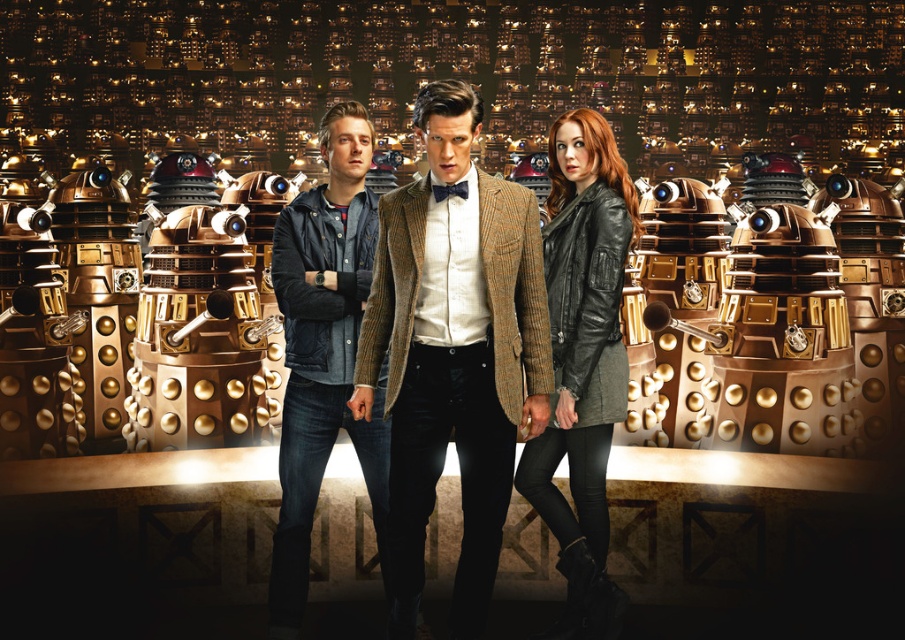
Question: Which object is closer to the camera taking this photo?

Choices:
 (A) black leather jacket at center
 (B) denim jacket at center

Answer: (A)

Question: Where is brown corduroy blazer at center located in relation to black leather jacket at center in the image?

Choices:
 (A) left
 (B) right

Answer: (A)

Question: Which point is farther to the camera?

Choices:
 (A) (420, 236)
 (B) (335, 250)

Answer: (B)

Question: Can you confirm if black leather jacket at center is positioned above denim jacket at center?

Choices:
 (A) no
 (B) yes

Answer: (A)

Question: Does brown corduroy blazer at center appear on the left side of denim jacket at center?

Choices:
 (A) yes
 (B) no

Answer: (B)

Question: Which point is farther to the camera?

Choices:
 (A) (372, 195)
 (B) (598, 472)
 (C) (415, 404)

Answer: (A)